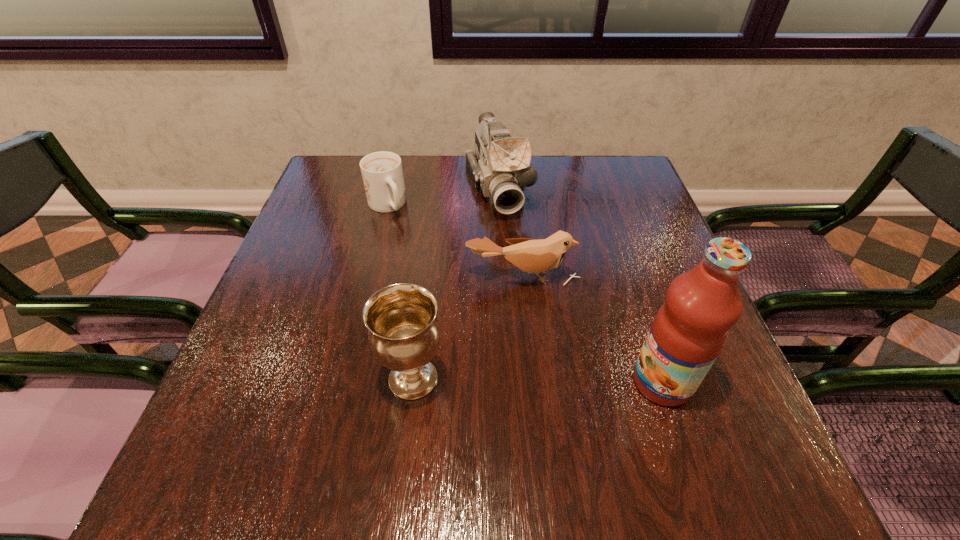
At what (x,y) coordinates should I click in order to perform the action: click on vacant area situated at the beak of the third farthest object. Please return your answer as a coordinate pair (x, y). Looking at the image, I should click on (522, 318).

Locate an element on the screen. free space located at the beak of the third farthest object is located at coordinates (524, 387).

At what (x,y) coordinates should I click in order to perform the action: click on vacant space situated 0.250m at the beak of the third farthest object. Please return your answer as a coordinate pair (x, y). The height and width of the screenshot is (540, 960). Looking at the image, I should click on (524, 392).

You are a GUI agent. You are given a task and a screenshot of the screen. Output one action in this format:
    pyautogui.click(x=<x>, y=<y>)
    Task: Click on the free spot located 0.210m on the side with the handle of the leftmost object
    The image size is (960, 540).
    Given the screenshot: What is the action you would take?
    pyautogui.click(x=425, y=271)

You are a GUI agent. You are given a task and a screenshot of the screen. Output one action in this format:
    pyautogui.click(x=<x>, y=<y>)
    Task: Click on the free space located on the side with the handle of the leftmost object
    The width and height of the screenshot is (960, 540).
    Given the screenshot: What is the action you would take?
    pyautogui.click(x=447, y=306)

The image size is (960, 540). Identify the location of vacant space located on the side with the handle of the leftmost object. (413, 252).

What are the coordinates of `vacant area located 0.130m on the front-facing side of the camcorder` in the screenshot? It's located at (518, 256).

At what (x,y) coordinates should I click in order to perform the action: click on free space located 0.350m on the front-facing side of the camcorder. Please return your answer as a coordinate pair (x, y). Image resolution: width=960 pixels, height=540 pixels. Looking at the image, I should click on (546, 330).

At what (x,y) coordinates should I click in order to perform the action: click on free point located 0.190m on the front-facing side of the camcorder. Please return your answer as a coordinate pair (x, y). This screenshot has width=960, height=540. Looking at the image, I should click on (525, 274).

I want to click on cappuccino at the far edge, so click(x=382, y=173).